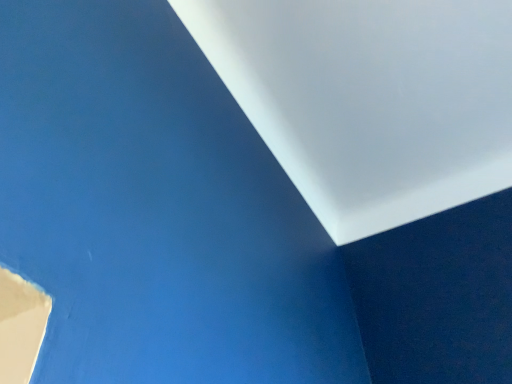
What do you see at coordinates (370, 99) in the screenshot?
I see `white matte ceiling at upper right` at bounding box center [370, 99].

From the picture: What is the approximate height of white matte ceiling at upper right?

white matte ceiling at upper right is 6.62 centimeters tall.

Identify the location of white matte ceiling at upper right. (370, 99).

Find the location of a particular element. white matte ceiling at upper right is located at coordinates (370, 99).